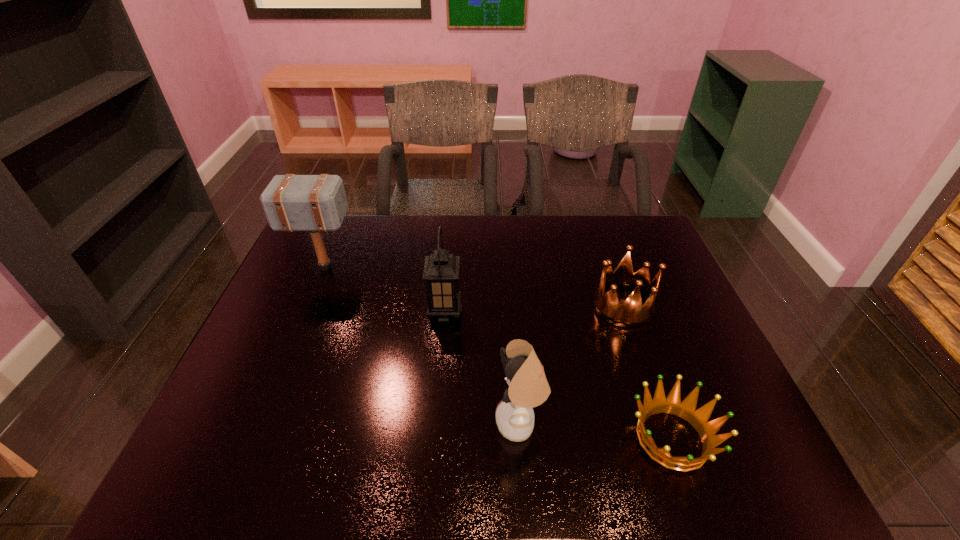
Locate an element on the screen. This screenshot has width=960, height=540. free point that satisfies the following two spatial constraints: 1. on the back side of the fourth object from right to left; 2. on the striking surface of the leftmost object is located at coordinates (448, 268).

This screenshot has width=960, height=540. Find the location of `vacant space that satisfies the following two spatial constraints: 1. on the front side of the farther crown; 2. at the front face of the doll`. vacant space that satisfies the following two spatial constraints: 1. on the front side of the farther crown; 2. at the front face of the doll is located at coordinates (663, 423).

In order to click on vacant area in the image that satisfies the following two spatial constraints: 1. on the front side of the shorter crown; 2. on the left side of the farther crown in this screenshot , I will do `click(668, 438)`.

Locate an element on the screen. vacant area in the image that satisfies the following two spatial constraints: 1. on the back side of the second object from left to right; 2. on the striking surface of the mallet is located at coordinates (448, 268).

Identify the location of free point that satisfies the following two spatial constraints: 1. on the striking surface of the farther crown; 2. on the left side of the farthest object. The height and width of the screenshot is (540, 960). (309, 306).

This screenshot has height=540, width=960. Identify the location of free space that satisfies the following two spatial constraints: 1. on the striking surface of the shortest object; 2. on the left side of the farthest object. (254, 438).